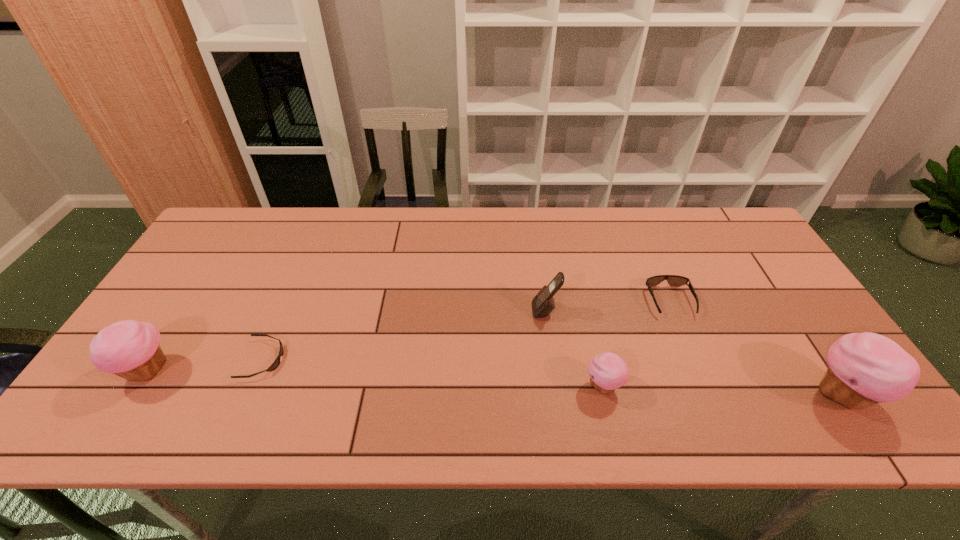
Please point a space for a new cupcake to maintain equal intervals. Please provide its 2D coordinates. Your answer should be formatted as a tuple, i.e. [(x, y)], where the tuple contains the x and y coordinates of a point satisfying the conditions above.

[(372, 379)]